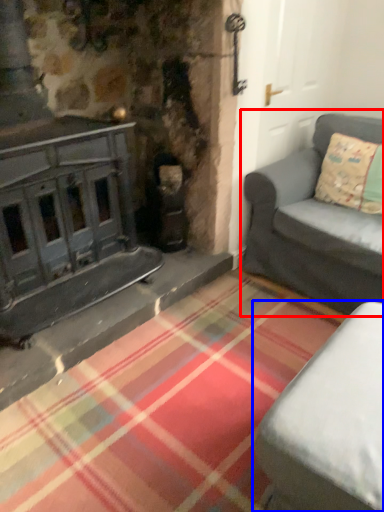
Question: Which of the following is the closest to the observer, studio couch (highlighted by a red box) or studio couch (highlighted by a blue box)?

Choices:
 (A) studio couch
 (B) studio couch

Answer: (B)